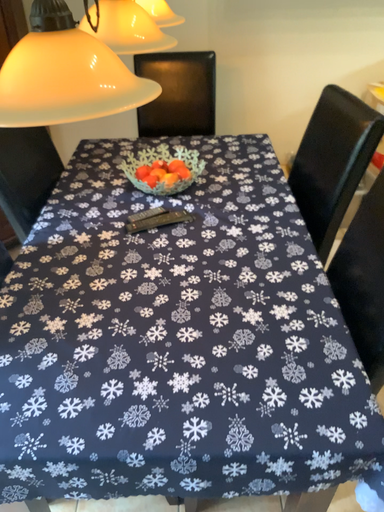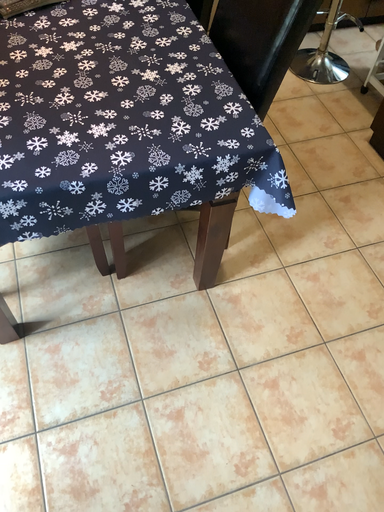
Question: How did the camera likely rotate when shooting the video?

Choices:
 (A) rotated left
 (B) rotated right

Answer: (B)